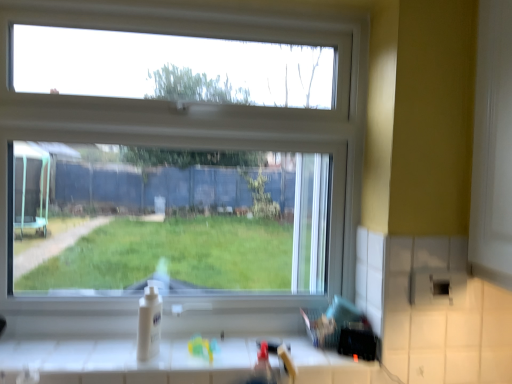
Question: Considering the relative positions of clear glass window at center and white glossy sink at lower center in the image provided, is clear glass window at center to the left of white glossy sink at lower center from the viewer's perspective?

Choices:
 (A) yes
 (B) no

Answer: (A)

Question: Is clear glass window at center positioned beyond the bounds of white glossy sink at lower center?

Choices:
 (A) no
 (B) yes

Answer: (B)

Question: From the image's perspective, would you say clear glass window at center is shown under white glossy sink at lower center?

Choices:
 (A) no
 (B) yes

Answer: (A)

Question: Is clear glass window at center smaller than white glossy sink at lower center?

Choices:
 (A) yes
 (B) no

Answer: (B)

Question: Is clear glass window at center taller than white glossy sink at lower center?

Choices:
 (A) yes
 (B) no

Answer: (A)

Question: Considering the positions of white glossy counter at lower center and clear glass window at center in the image, is white glossy counter at lower center taller or shorter than clear glass window at center?

Choices:
 (A) tall
 (B) short

Answer: (B)

Question: In terms of size, does white glossy counter at lower center appear bigger or smaller than clear glass window at center?

Choices:
 (A) big
 (B) small

Answer: (B)

Question: Is white glossy counter at lower center wider or thinner than clear glass window at center?

Choices:
 (A) wide
 (B) thin

Answer: (A)

Question: Do you think white glossy counter at lower center is within clear glass window at center, or outside of it?

Choices:
 (A) inside
 (B) outside

Answer: (B)

Question: Is white glossy sink at lower center situated inside white glossy counter at lower center or outside?

Choices:
 (A) outside
 (B) inside

Answer: (A)

Question: In terms of width, does white glossy sink at lower center look wider or thinner when compared to white glossy counter at lower center?

Choices:
 (A) thin
 (B) wide

Answer: (A)

Question: Considering the positions of white glossy sink at lower center and white glossy counter at lower center in the image, is white glossy sink at lower center taller or shorter than white glossy counter at lower center?

Choices:
 (A) tall
 (B) short

Answer: (A)

Question: From the image's perspective, is white glossy sink at lower center above or below white glossy counter at lower center?

Choices:
 (A) above
 (B) below

Answer: (A)

Question: Is white glossy sink at lower center inside the boundaries of clear glass window at center, or outside?

Choices:
 (A) inside
 (B) outside

Answer: (B)

Question: Relative to clear glass window at center, is white glossy sink at lower center in front or behind?

Choices:
 (A) behind
 (B) front

Answer: (B)